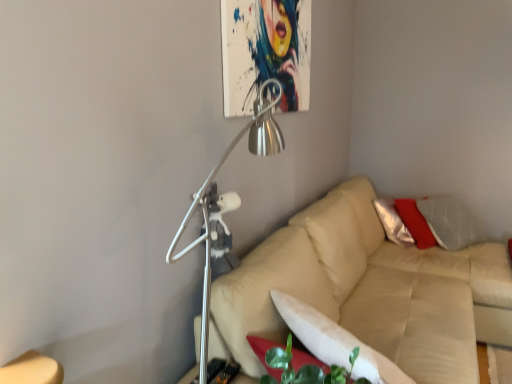
Question: Does metallic silver lamp at upper center have a lesser height compared to beige leather couch at center?

Choices:
 (A) no
 (B) yes

Answer: (A)

Question: Does metallic silver lamp at upper center have a greater height compared to beige leather couch at center?

Choices:
 (A) yes
 (B) no

Answer: (A)

Question: Is metallic silver lamp at upper center wider than beige leather couch at center?

Choices:
 (A) yes
 (B) no

Answer: (B)

Question: Is metallic silver lamp at upper center aimed at beige leather couch at center?

Choices:
 (A) no
 (B) yes

Answer: (A)

Question: Is metallic silver lamp at upper center smaller than beige leather couch at center?

Choices:
 (A) no
 (B) yes

Answer: (B)

Question: Does metallic silver lamp at upper center have a lesser width compared to beige leather couch at center?

Choices:
 (A) no
 (B) yes

Answer: (B)

Question: Is white soft pillow at lower center turned away from metallic silver lamp at upper center?

Choices:
 (A) yes
 (B) no

Answer: (A)

Question: From a real-world perspective, is white soft pillow at lower center positioned over metallic silver lamp at upper center based on gravity?

Choices:
 (A) yes
 (B) no

Answer: (B)

Question: Considering the relative positions of white soft pillow at lower center and metallic silver lamp at upper center in the image provided, is white soft pillow at lower center to the right of metallic silver lamp at upper center from the viewer's perspective?

Choices:
 (A) yes
 (B) no

Answer: (A)

Question: Is white soft pillow at lower center to the left of metallic silver lamp at upper center from the viewer's perspective?

Choices:
 (A) yes
 (B) no

Answer: (B)

Question: Does white soft pillow at lower center have a smaller size compared to metallic silver lamp at upper center?

Choices:
 (A) no
 (B) yes

Answer: (B)

Question: Is white soft pillow at lower center further to camera compared to metallic silver lamp at upper center?

Choices:
 (A) no
 (B) yes

Answer: (B)

Question: Is metallic silver lamp at upper center positioned with its back to white soft pillow at lower center?

Choices:
 (A) yes
 (B) no

Answer: (A)